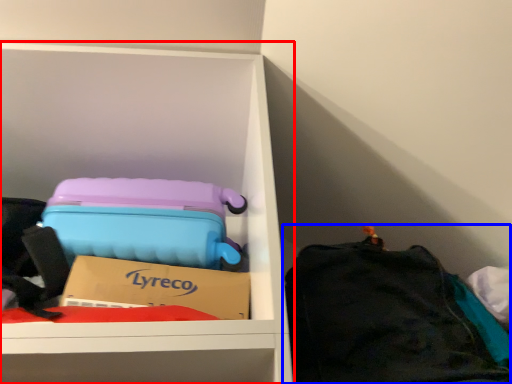
Question: Which object appears farthest to the camera in this image, furniture (highlighted by a red box) or luggage and bags (highlighted by a blue box)?

Choices:
 (A) furniture
 (B) luggage and bags

Answer: (A)